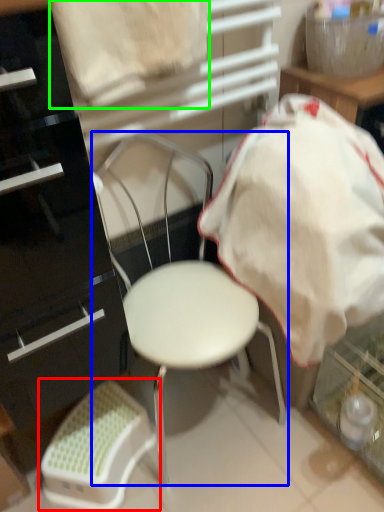
Question: Which object is positioned farthest from bar stool (highlighted by a red box)? Select from chair (highlighted by a blue box) and sheet (highlighted by a green box).

Choices:
 (A) chair
 (B) sheet

Answer: (B)